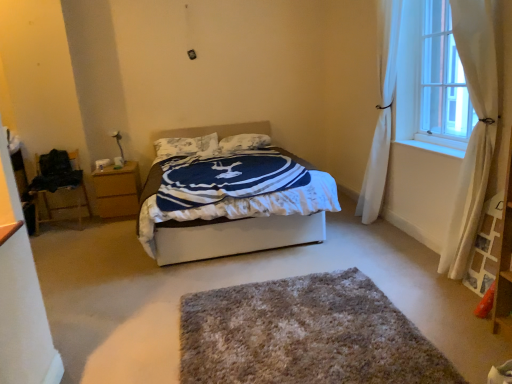
This screenshot has width=512, height=384. Identify the location of vacant space underneath white sheer curtain at right, the second curtain viewed from the front (from a real-world perspective). (381, 230).